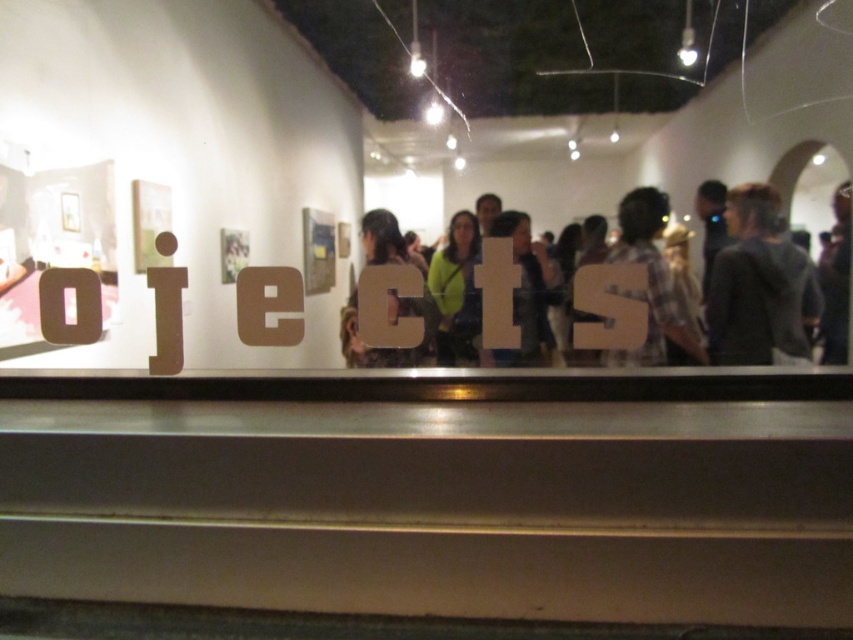
The width and height of the screenshot is (853, 640). In order to click on green fabric shirt at center in this screenshot , I will do `click(807, 288)`.

Which of these two, green fabric shirt at center or matte brown letter c at center, stands taller?

Standing taller between the two is green fabric shirt at center.

This screenshot has height=640, width=853. What are the coordinates of `green fabric shirt at center` in the screenshot? It's located at (807, 288).

You are a GUI agent. You are given a task and a screenshot of the screen. Output one action in this format:
    pyautogui.click(x=<x>, y=<y>)
    Task: Click on the green fabric shirt at center
    This screenshot has height=640, width=853.
    Given the screenshot: What is the action you would take?
    pyautogui.click(x=807, y=288)

Does point (735, 266) lie in front of point (630, 244)?

Yes.

Does dark gray sweater at right appear over plaid shirt at center?

Correct, dark gray sweater at right is located above plaid shirt at center.

Does point (729, 288) lie behind point (612, 362)?

That is False.

Identify the location of dark gray sweater at right. Image resolution: width=853 pixels, height=640 pixels. (758, 284).

Which is behind, point (805, 262) or point (668, 205)?

Point (668, 205)

Can you confirm if green fabric shirt at center is positioned to the right of plaid shirt at center?

Indeed, green fabric shirt at center is positioned on the right side of plaid shirt at center.

Locate an element on the screen. This screenshot has height=640, width=853. green fabric shirt at center is located at coordinates (807, 288).